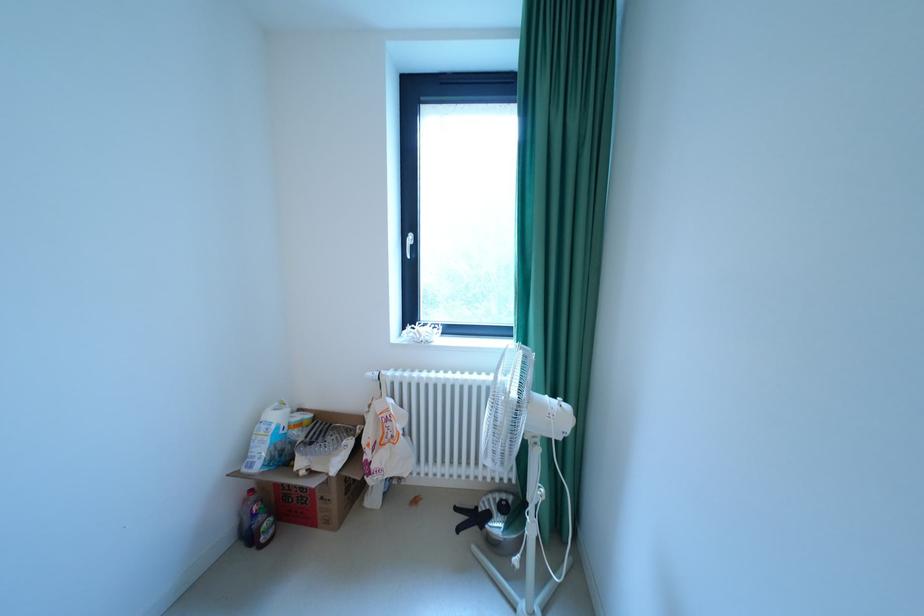
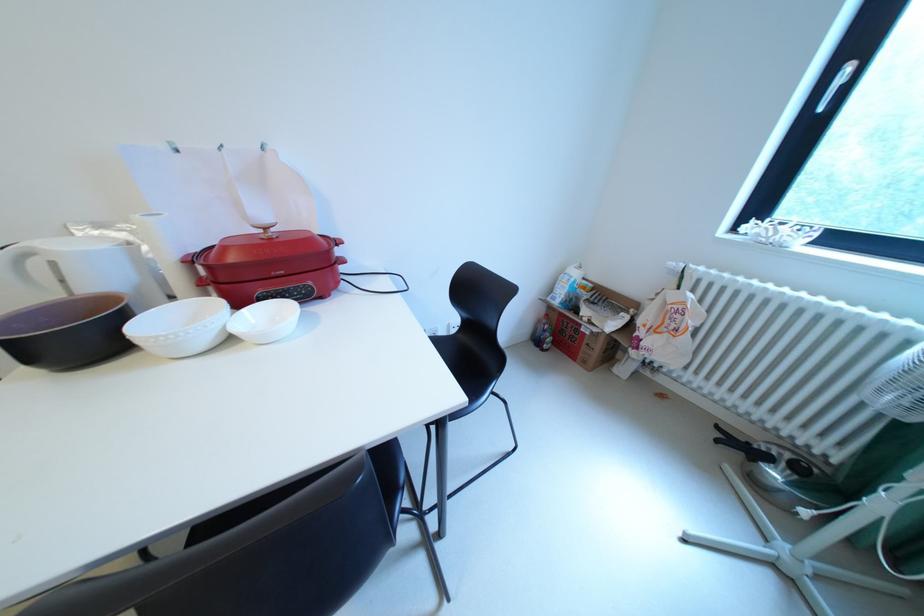
Where in the second image is the point corresponding to point (388, 407) from the first image?

(682, 297)